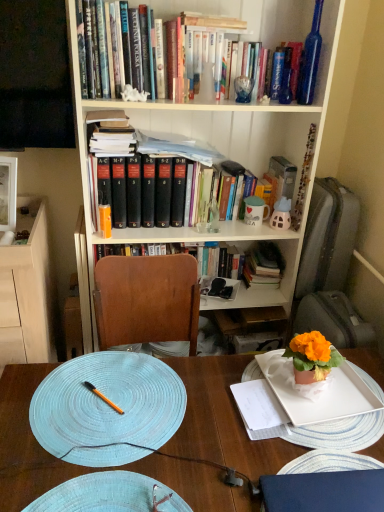
Identify the location of vacant area that lies to the right of white paper notebook at center. (326, 425).